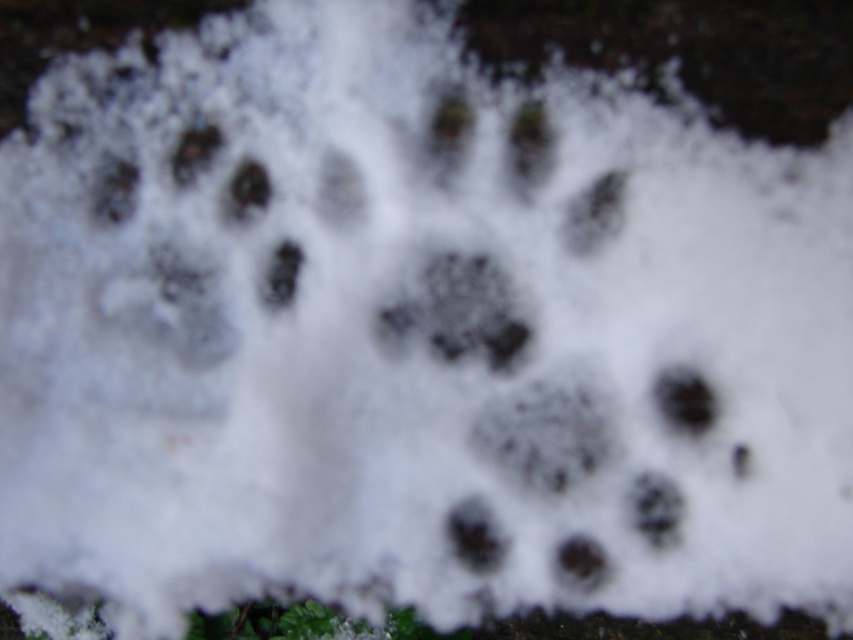
Measure the distance between point (527, 324) and camera.

Point (527, 324) and camera are 5.68 feet apart.

Between dark textured paw print at center and black rubber footprint at lower right, which one appears on the right side from the viewer's perspective?

Positioned to the right is black rubber footprint at lower right.

Which is behind, point (515, 324) or point (689, 429)?

Point (515, 324)

Locate an element on the screen. dark textured paw print at center is located at coordinates (461, 308).